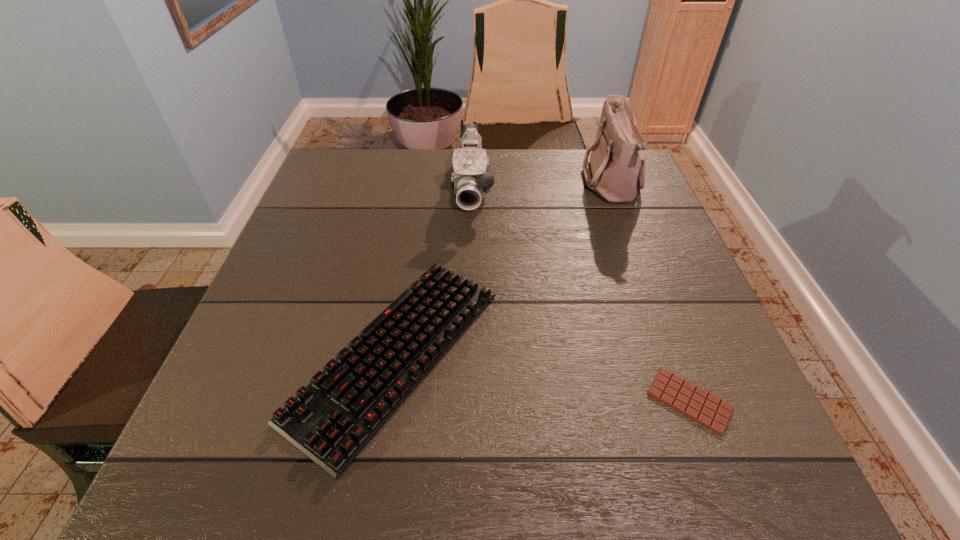
Where is `free space between the second shortest object and the shoulder bag`? This screenshot has height=540, width=960. free space between the second shortest object and the shoulder bag is located at coordinates (504, 269).

This screenshot has height=540, width=960. Find the location of `blank region between the shortest object and the shoulder bag`. blank region between the shortest object and the shoulder bag is located at coordinates (650, 293).

Where is `the second closest object to the shoulder bag`? The width and height of the screenshot is (960, 540). the second closest object to the shoulder bag is located at coordinates (331, 420).

Where is `object that is the third nearest to the shoulder bag`? The image size is (960, 540). object that is the third nearest to the shoulder bag is located at coordinates (694, 402).

Find the location of a particular element. vacant space that satisfies the following two spatial constraints: 1. on the front pocket of the shoulder bag; 2. on the front-facing side of the camcorder is located at coordinates (612, 187).

The width and height of the screenshot is (960, 540). What are the coordinates of `vacant point that satisfies the following two spatial constraints: 1. on the front pocket of the shoulder bag; 2. on the front side of the candy bar` in the screenshot? It's located at (692, 401).

Locate an element on the screen. This screenshot has width=960, height=540. vacant space that satisfies the following two spatial constraints: 1. on the front pocket of the shoulder bag; 2. on the front-facing side of the camcorder is located at coordinates (612, 187).

Locate an element on the screen. This screenshot has height=540, width=960. vacant position in the image that satisfies the following two spatial constraints: 1. on the front-facing side of the camcorder; 2. on the right side of the candy bar is located at coordinates (467, 401).

The width and height of the screenshot is (960, 540). Identify the location of blank area in the image that satisfies the following two spatial constraints: 1. on the front pocket of the shoulder bag; 2. on the front-facing side of the camcorder. (612, 187).

I want to click on vacant space that satisfies the following two spatial constraints: 1. on the front-facing side of the candy bar; 2. on the left side of the camcorder, so click(x=467, y=401).